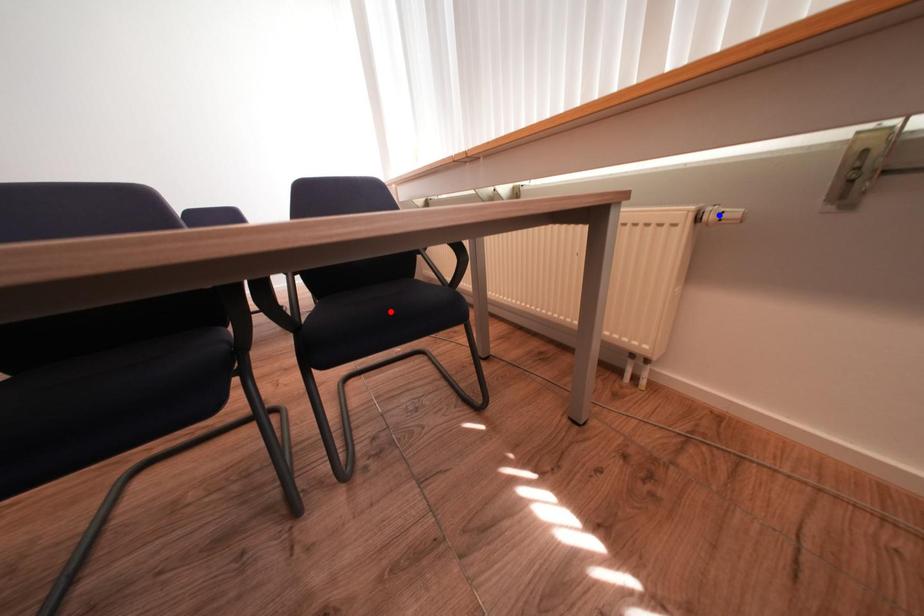
Question: In the image, two points are highlighted. Which point is nearer to the camera? Reply with the corresponding letter.

Choices:
 (A) blue point
 (B) red point

Answer: (A)